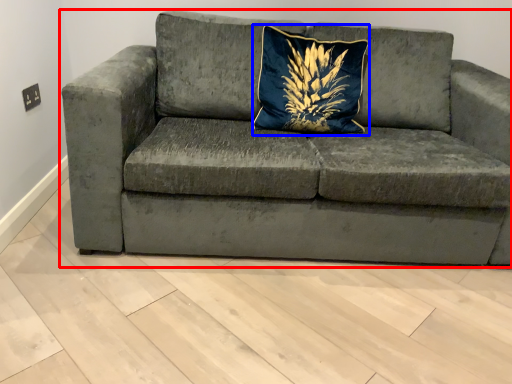
Question: Which point is closer to the camera, studio couch (highlighted by a red box) or pillow (highlighted by a blue box)?

Choices:
 (A) studio couch
 (B) pillow

Answer: (A)